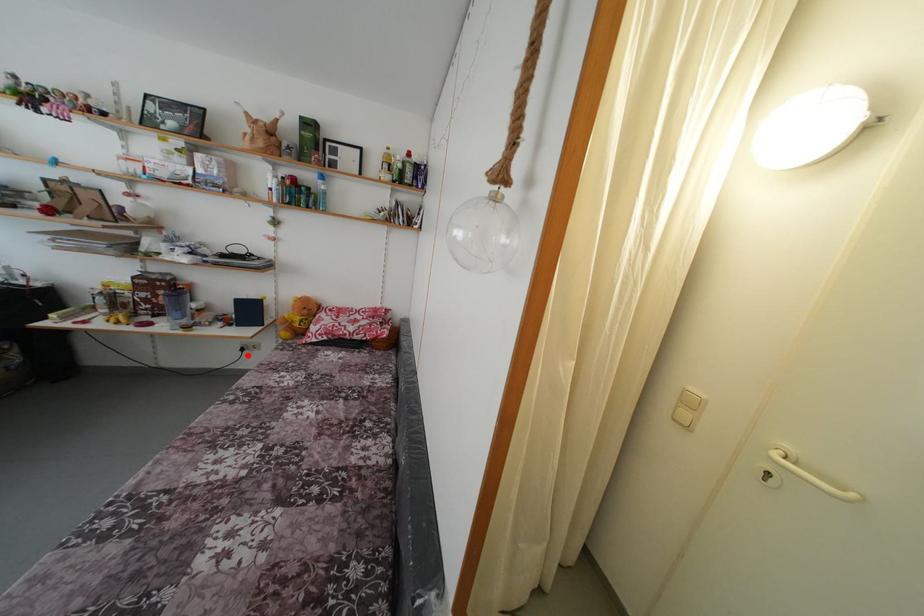
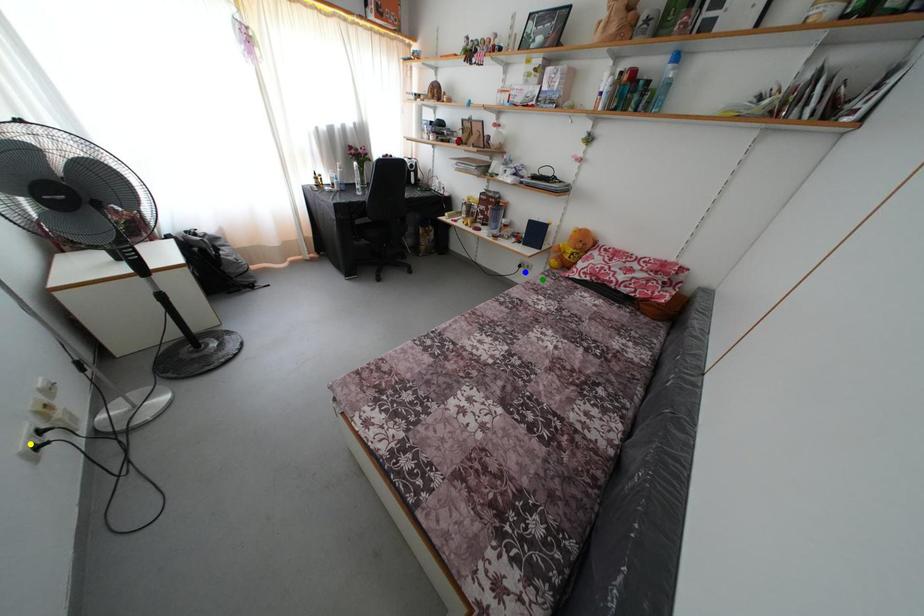
Question: I am providing you with two images of the same scene from different viewpoints. A red point is marked on the first image. You are given multiple points on the second image. Which point in image 2 is actually the same real-world point as the red point in image 1?

Choices:
 (A) green point
 (B) yellow point
 (C) blue point

Answer: (C)